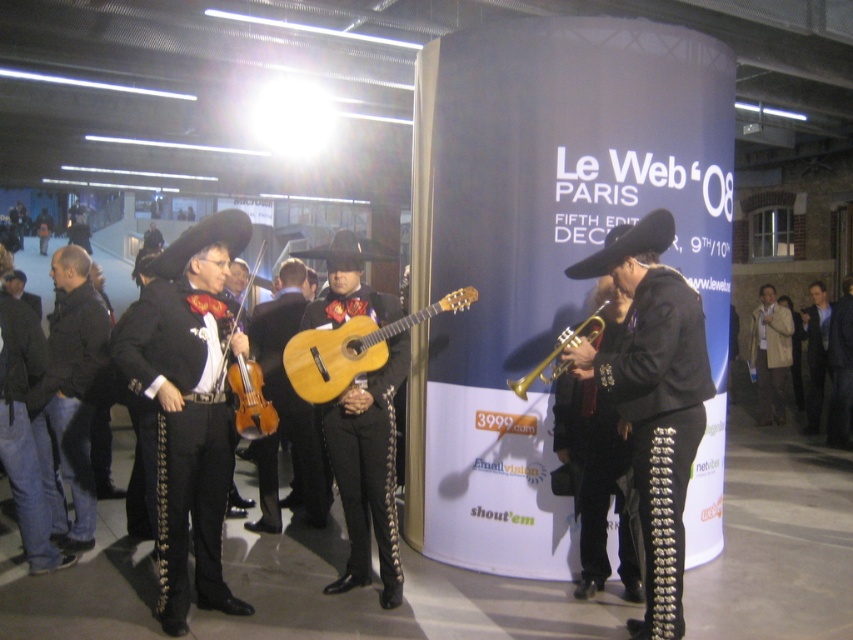
Can you confirm if black leather pants at right is wider than light beige fabric coat at right?

Yes, black leather pants at right is wider than light beige fabric coat at right.

Between black leather pants at right and light beige fabric coat at right, which one is positioned lower?

black leather pants at right is lower down.

Is point (573, 278) positioned after point (766, 326)?

That is False.

Locate an element on the screen. Image resolution: width=853 pixels, height=640 pixels. black leather pants at right is located at coordinates (653, 397).

Can you confirm if black leather pants at right is positioned below matte black violin at center?

Actually, black leather pants at right is above matte black violin at center.

Which is more to the right, black leather pants at right or matte black violin at center?

black leather pants at right is more to the right.

Image resolution: width=853 pixels, height=640 pixels. I want to click on black leather pants at right, so click(x=653, y=397).

Which of these two, matte black mariachi outfit at left or black leather jacket at left, stands shorter?

black leather jacket at left is shorter.

Between matte black mariachi outfit at left and black leather jacket at left, which one is positioned lower?

Positioned lower is black leather jacket at left.

Is point (225, 326) more distant than point (79, 390)?

That is False.

At what (x,y) coordinates should I click in order to perform the action: click on matte black mariachi outfit at left. Please return your answer as a coordinate pair (x, y). Looking at the image, I should click on (187, 404).